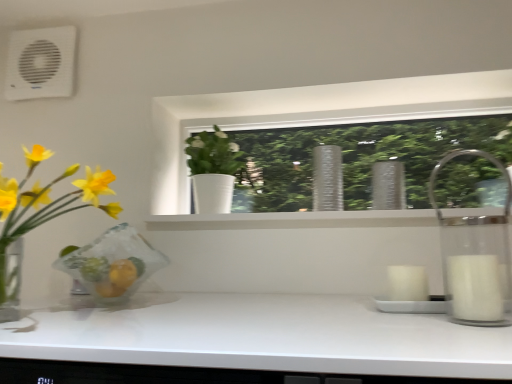
Question: From a real-world perspective, is clear glass vase at center over translucent glass vase at left, which is the 1th houseplant from front to back?

Choices:
 (A) no
 (B) yes

Answer: (B)

Question: Is clear glass vase at center not inside translucent glass vase at left, which is the 1th houseplant from front to back?

Choices:
 (A) no
 (B) yes

Answer: (B)

Question: Is clear glass vase at center turned away from translucent glass vase at left, positioned as the second houseplant in right-to-left order?

Choices:
 (A) no
 (B) yes

Answer: (A)

Question: Is clear glass vase at center with translucent glass vase at left, the first houseplant when ordered from left to right?

Choices:
 (A) yes
 (B) no

Answer: (B)

Question: From the image's perspective, is clear glass vase at center below translucent glass vase at left, the first houseplant when ordered from left to right?

Choices:
 (A) no
 (B) yes

Answer: (A)

Question: From a real-world perspective, relative to translucent glass vase at left, positioned as the second houseplant in right-to-left order, is clear glass vase at center vertically above or below?

Choices:
 (A) above
 (B) below

Answer: (A)

Question: Which is correct: clear glass vase at center is inside translucent glass vase at left, positioned as the second houseplant in right-to-left order, or outside of it?

Choices:
 (A) outside
 (B) inside

Answer: (A)

Question: From the image's perspective, is clear glass vase at center located above or below translucent glass vase at left, positioned as the second houseplant in right-to-left order?

Choices:
 (A) below
 (B) above

Answer: (B)

Question: Is clear glass vase at center taller or shorter than translucent glass vase at left, which is the 1th houseplant from front to back?

Choices:
 (A) tall
 (B) short

Answer: (B)

Question: Relative to clear glass vase at center, is white plastic air conditioning unit at upper left in front or behind?

Choices:
 (A) behind
 (B) front

Answer: (A)

Question: Is white plastic air conditioning unit at upper left inside or outside of clear glass vase at center?

Choices:
 (A) inside
 (B) outside

Answer: (B)

Question: Is white plastic air conditioning unit at upper left taller or shorter than clear glass vase at center?

Choices:
 (A) short
 (B) tall

Answer: (B)

Question: Is white plastic air conditioning unit at upper left bigger or smaller than clear glass vase at center?

Choices:
 (A) small
 (B) big

Answer: (A)

Question: Is white plastic air conditioning unit at upper left in front of or behind translucent glass vase at left, positioned as the second houseplant in back-to-front order, in the image?

Choices:
 (A) front
 (B) behind

Answer: (B)

Question: In terms of height, does white plastic air conditioning unit at upper left look taller or shorter compared to translucent glass vase at left, which is the 1th houseplant from front to back?

Choices:
 (A) short
 (B) tall

Answer: (A)